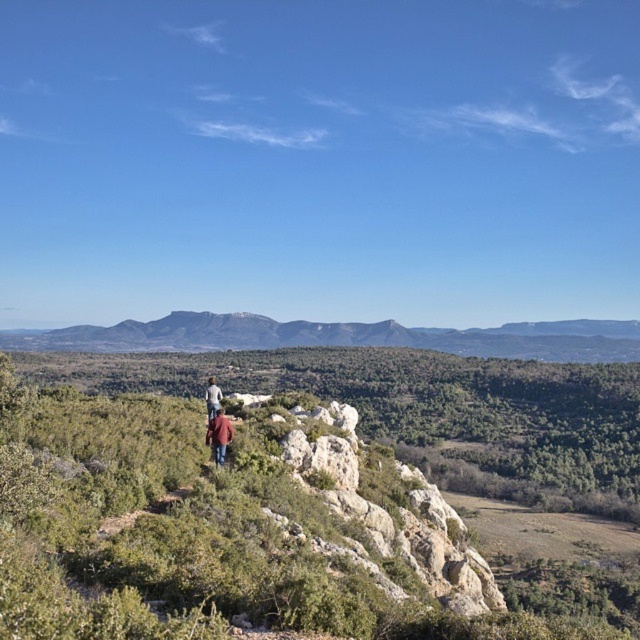
Question: Which point is closer to the camera?

Choices:
 (A) (355, 637)
 (B) (232, 435)

Answer: (A)

Question: Which point is farther from the camera taking this photo?

Choices:
 (A) (179, 369)
 (B) (180, 310)

Answer: (B)

Question: Is green shrubbery at center above light blue denim jacket at center?

Choices:
 (A) yes
 (B) no

Answer: (B)

Question: Can you confirm if brown leather jacket at center is positioned below light blue denim jacket at center?

Choices:
 (A) yes
 (B) no

Answer: (B)

Question: Can you confirm if brown leather jacket at center is positioned to the right of light blue denim jacket at center?

Choices:
 (A) no
 (B) yes

Answer: (B)

Question: Which of the following is the farthest from the observer?

Choices:
 (A) (218, 452)
 (B) (214, 396)

Answer: (B)